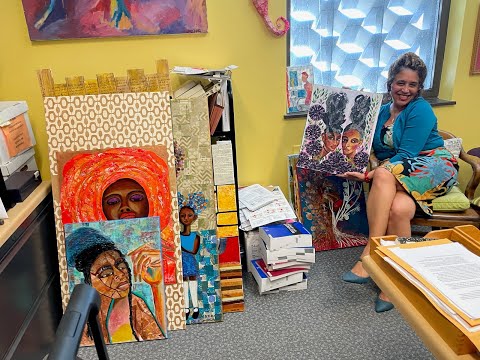
The image size is (480, 360). Find the location of `paintings stacked against wall`. paintings stacked against wall is located at coordinates (147, 126).